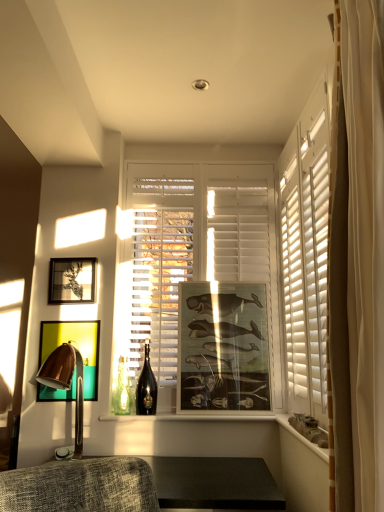
Locate an element on the screen. Image resolution: width=384 pixels, height=512 pixels. free area in between matte wooden picture frame at center, which appears as the first picture frame when viewed from the right, and shiny dark glass bottle at center is located at coordinates (179, 417).